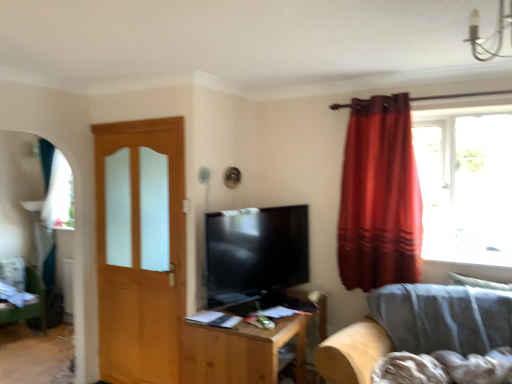
Where is `free space above light brown wooden door at left (from a real-world perspective)`? free space above light brown wooden door at left (from a real-world perspective) is located at coordinates (136, 127).